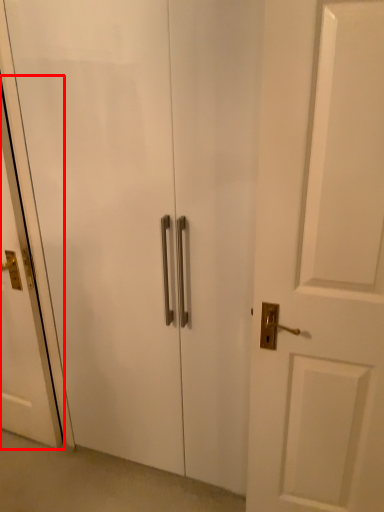
Question: From the image's perspective, what is the correct spatial relationship of screen door (annotated by the red box) in relation to elevator?

Choices:
 (A) below
 (B) above

Answer: (B)